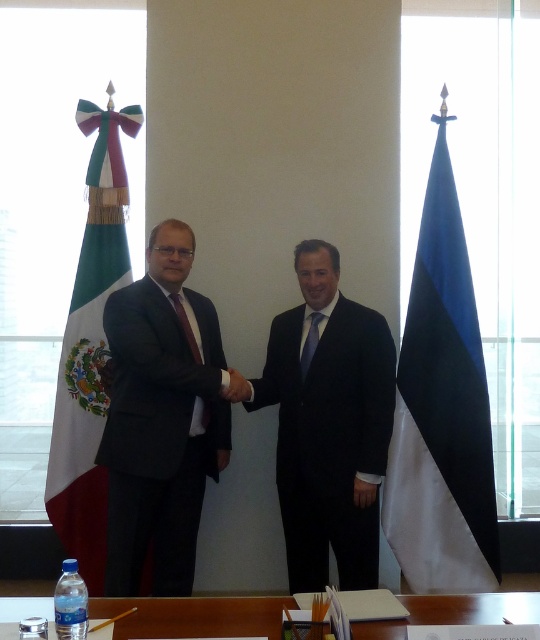
Consider the image. Who is higher up, black suit at center or clear plastic bottle at lower center?

black suit at center is above.

Is black suit at center below clear plastic bottle at lower center?

No, black suit at center is not below clear plastic bottle at lower center.

Does point (325, 500) come behind point (132, 630)?

Yes, it is.

Locate an element on the screen. The height and width of the screenshot is (640, 540). black suit at center is located at coordinates (328, 426).

Looking at this image, does blue silk tie at center appear under matte black hand at center?

Actually, blue silk tie at center is above matte black hand at center.

Is point (307, 362) farther from camera compared to point (235, 381)?

That is True.

Who is more forward, [308,355] or [246,384]?

Positioned in front is point [246,384].

This screenshot has width=540, height=640. Identify the location of blue silk tie at center. (309, 342).

Who is shorter, blue fabric flag at right or green fabric flag at left?

With less height is blue fabric flag at right.

Identify the location of blue fabric flag at right. (442, 410).